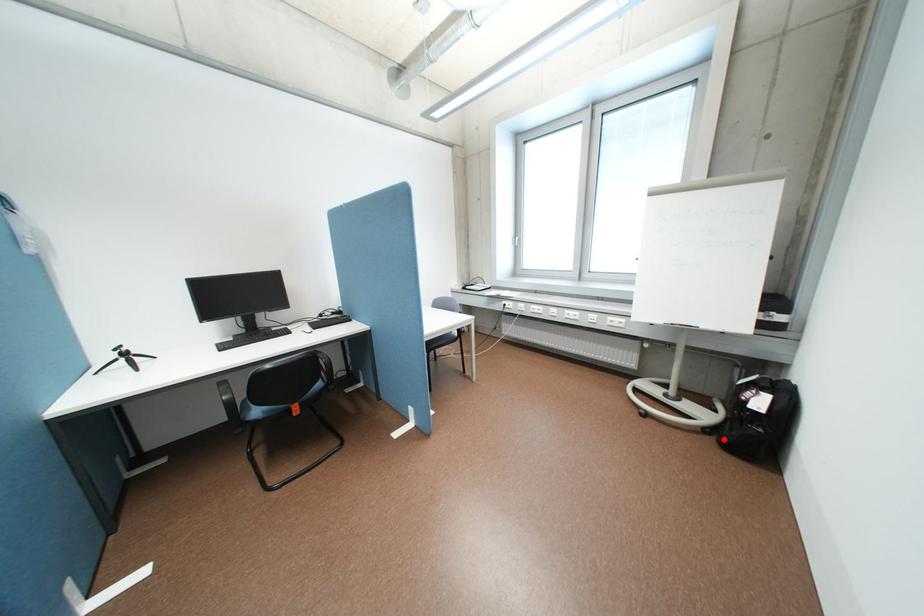
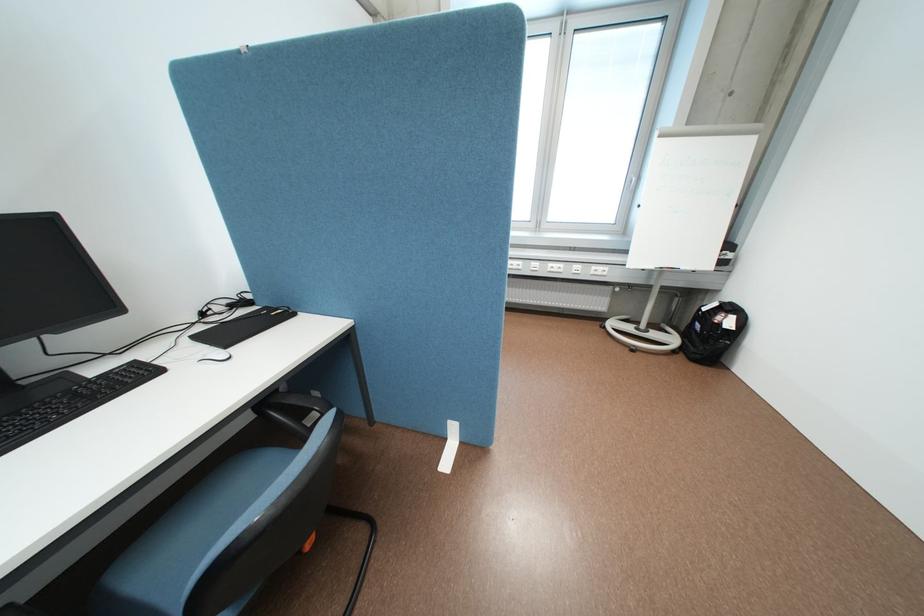
Question: I am providing you with two images of the same scene from different viewpoints. Image1 has a red point marked. In image2, the corresponding 3D location appears at what relative position? Reply with the corresponding letter.

Choices:
 (A) Closer
 (B) Farther

Answer: (A)